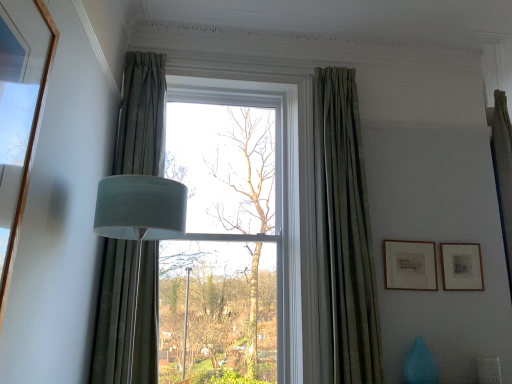
Question: Can you confirm if matte black picture frame at right, which ranks as the second picture frame in left-to-right order, is wider than matte gold picture frame at right, the second picture frame in the right-to-left sequence?

Choices:
 (A) no
 (B) yes

Answer: (A)

Question: Is the position of matte black picture frame at right, which appears as the first picture frame when viewed from the right, less distant than that of matte gold picture frame at right, arranged as the first picture frame when viewed from the left?

Choices:
 (A) yes
 (B) no

Answer: (B)

Question: Is matte black picture frame at right, which ranks as the second picture frame in left-to-right order, beside matte gold picture frame at right, the second picture frame in the right-to-left sequence?

Choices:
 (A) no
 (B) yes

Answer: (A)

Question: From the image's perspective, does matte black picture frame at right, which appears as the first picture frame when viewed from the right, appear lower than matte gold picture frame at right, arranged as the first picture frame when viewed from the left?

Choices:
 (A) yes
 (B) no

Answer: (A)

Question: Does matte black picture frame at right, which appears as the first picture frame when viewed from the right, have a lesser width compared to matte gold picture frame at right, the second picture frame in the right-to-left sequence?

Choices:
 (A) yes
 (B) no

Answer: (A)

Question: Is matte black picture frame at right, which ranks as the second picture frame in left-to-right order, turned away from matte gold picture frame at right, the second picture frame in the right-to-left sequence?

Choices:
 (A) no
 (B) yes

Answer: (A)

Question: Are matte black picture frame at right, which appears as the first picture frame when viewed from the right, and green fabric curtain at left, positioned as the 2th curtain in right-to-left order, far apart?

Choices:
 (A) no
 (B) yes

Answer: (B)

Question: Is matte black picture frame at right, which appears as the first picture frame when viewed from the right, smaller than green fabric curtain at left, positioned as the 2th curtain in right-to-left order?

Choices:
 (A) yes
 (B) no

Answer: (A)

Question: Can you see matte black picture frame at right, which appears as the first picture frame when viewed from the right, touching green fabric curtain at left, positioned as the 2th curtain in right-to-left order?

Choices:
 (A) yes
 (B) no

Answer: (B)

Question: Does matte black picture frame at right, which appears as the first picture frame when viewed from the right, have a lesser height compared to green fabric curtain at left, positioned as the 2th curtain in right-to-left order?

Choices:
 (A) yes
 (B) no

Answer: (A)

Question: Is matte black picture frame at right, which appears as the first picture frame when viewed from the right, facing towards green fabric curtain at left, which is the first curtain from left to right?

Choices:
 (A) yes
 (B) no

Answer: (B)

Question: Can you confirm if matte black picture frame at right, which ranks as the second picture frame in left-to-right order, is taller than green fabric curtain at left, which is the first curtain from left to right?

Choices:
 (A) no
 (B) yes

Answer: (A)

Question: Is the surface of green fabric curtain at left, positioned as the 2th curtain in right-to-left order, in direct contact with matte blue vase at lower right?

Choices:
 (A) yes
 (B) no

Answer: (B)